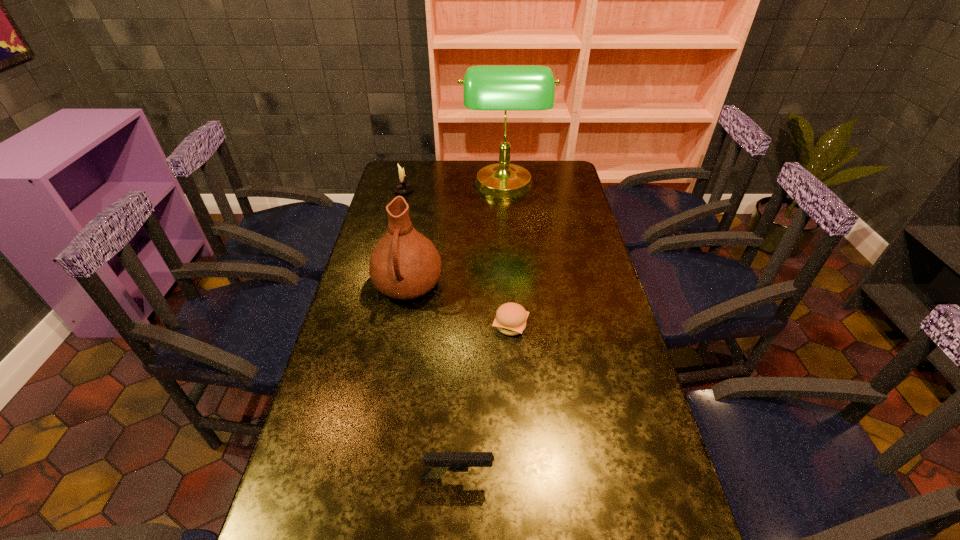
Where is `vacant space situated 0.160m on the back of the third tallest object`? This screenshot has height=540, width=960. vacant space situated 0.160m on the back of the third tallest object is located at coordinates (409, 168).

Locate an element on the screen. Image resolution: width=960 pixels, height=540 pixels. free spot located 0.230m on the front-facing side of the nearest object is located at coordinates (598, 478).

Image resolution: width=960 pixels, height=540 pixels. I want to click on blank space located 0.400m on the left of the hamburger, so click(356, 326).

Locate an element on the screen. This screenshot has height=540, width=960. lamp positioned at the far edge is located at coordinates (505, 88).

The width and height of the screenshot is (960, 540). What are the coordinates of `candle holder that is at the far edge` in the screenshot? It's located at (402, 188).

Where is `pitcher at the left edge`? The image size is (960, 540). pitcher at the left edge is located at coordinates (404, 264).

This screenshot has height=540, width=960. Find the location of `candle holder that is at the left edge`. candle holder that is at the left edge is located at coordinates (402, 188).

You are a GUI agent. You are given a task and a screenshot of the screen. Output one action in this format:
    pyautogui.click(x=<x>, y=<y>)
    Task: Click on the object present at the right edge
    The image size is (960, 540).
    Given the screenshot: What is the action you would take?
    pyautogui.click(x=505, y=88)

Image resolution: width=960 pixels, height=540 pixels. I want to click on object that is at the far left corner, so click(402, 188).

You are a GUI agent. You are given a task and a screenshot of the screen. Output one action in this format:
    pyautogui.click(x=<x>, y=<y>)
    Task: Click on the object present at the far right corner
    
    Given the screenshot: What is the action you would take?
    pyautogui.click(x=505, y=88)